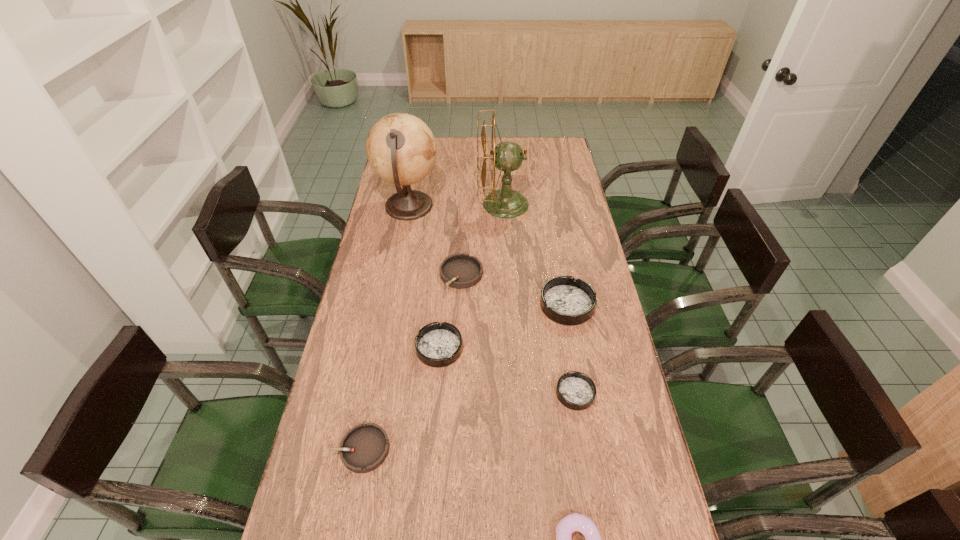
At what (x,y) coordinates should I click in order to perform the action: click on globe positioned at the left edge. Please return your answer as a coordinate pair (x, y). The width and height of the screenshot is (960, 540). Looking at the image, I should click on (401, 149).

Locate an element on the screen. This screenshot has height=540, width=960. ashtray present at the left edge is located at coordinates (364, 448).

Identify the location of vacant region at the far edge of the desktop. (460, 144).

At what (x,y) coordinates should I click in order to perform the action: click on vacant space at the left edge of the desktop. Please return your answer as a coordinate pair (x, y). The height and width of the screenshot is (540, 960). Looking at the image, I should click on (325, 486).

Find the location of a particular element. free space at the right edge is located at coordinates (645, 523).

Find the location of a particular element. The height and width of the screenshot is (540, 960). free point between the second nearest ashtray and the seventh farthest object is located at coordinates (x=468, y=421).

Locate an element on the screen. free space that is in between the smaller gray ashtray and the farther gray ashtray is located at coordinates (412, 362).

Find the location of `vacant point located between the globe and the fan`. vacant point located between the globe and the fan is located at coordinates (456, 205).

You are a GUI agent. You are given a task and a screenshot of the screen. Output one action in this format:
    pyautogui.click(x=<x>, y=<y>)
    Task: Click on the free spot between the globe and the fan
    
    Given the screenshot: What is the action you would take?
    pyautogui.click(x=456, y=205)

Find the location of a particular element. The image size is (960, 540). free spot between the bigger gray ashtray and the farthest dark ashtray is located at coordinates (515, 290).